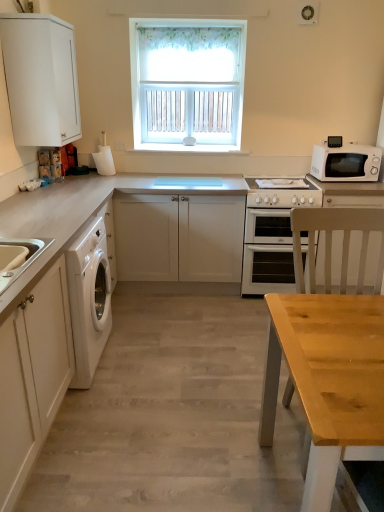
Question: Is white matte cabinet at center, which is the 1th cabinetry in back-to-front order, to the right of white matte cabinet at left, the 1th cabinetry viewed from the front, from the viewer's perspective?

Choices:
 (A) no
 (B) yes

Answer: (B)

Question: Is white matte cabinet at center, which ranks as the second cabinetry in bottom-to-top order, facing towards white matte cabinet at left, the 1th cabinetry in the bottom-to-top sequence?

Choices:
 (A) yes
 (B) no

Answer: (A)

Question: Does white matte cabinet at center, which is the 1th cabinetry in back-to-front order, have a smaller size compared to white matte cabinet at left, the 1th cabinetry in the bottom-to-top sequence?

Choices:
 (A) yes
 (B) no

Answer: (B)

Question: Can you confirm if white matte cabinet at center, placed as the 2th cabinetry when sorted from top to bottom, is taller than white matte cabinet at left, the 3th cabinetry when ordered from back to front?

Choices:
 (A) yes
 (B) no

Answer: (B)

Question: Considering the relative sizes of white matte cabinet at center, which appears as the 3th cabinetry when viewed from the front, and white matte cabinet at left, the 3th cabinetry when ordered from back to front, in the image provided, is white matte cabinet at center, which appears as the 3th cabinetry when viewed from the front, bigger than white matte cabinet at left, the 3th cabinetry when ordered from back to front,?

Choices:
 (A) no
 (B) yes

Answer: (B)

Question: From a real-world perspective, relative to white matte cabinet at center, placed as the 2th cabinetry when sorted from top to bottom, is white glossy oven at center vertically above or below?

Choices:
 (A) above
 (B) below

Answer: (B)

Question: In the image, is white glossy oven at center positioned in front of or behind white matte cabinet at center, which ranks as the second cabinetry in bottom-to-top order?

Choices:
 (A) front
 (B) behind

Answer: (B)

Question: From the image's perspective, is white glossy oven at center positioned above or below white matte cabinet at center, which ranks as the second cabinetry in bottom-to-top order?

Choices:
 (A) above
 (B) below

Answer: (B)

Question: Considering the positions of point (261, 263) and point (195, 245), is point (261, 263) closer or farther from the camera than point (195, 245)?

Choices:
 (A) farther
 (B) closer

Answer: (A)

Question: Choose the correct answer: Is white matte microwave at right inside white matte cabinet at center, which appears as the 3th cabinetry when viewed from the front, or outside it?

Choices:
 (A) outside
 (B) inside

Answer: (A)

Question: From a real-world perspective, is white matte microwave at right above or below white matte cabinet at center, which is the 1th cabinetry in back-to-front order?

Choices:
 (A) below
 (B) above

Answer: (B)

Question: Does point (362, 150) appear closer or farther from the camera than point (211, 219)?

Choices:
 (A) closer
 (B) farther

Answer: (B)

Question: Is white matte microwave at right wider or thinner than white matte cabinet at center, which is the 1th cabinetry in back-to-front order?

Choices:
 (A) thin
 (B) wide

Answer: (A)

Question: Considering their positions, is white wooden window at upper center located in front of or behind white matte washing machine at left?

Choices:
 (A) front
 (B) behind

Answer: (B)

Question: From the image's perspective, is white wooden window at upper center positioned above or below white matte washing machine at left?

Choices:
 (A) below
 (B) above

Answer: (B)